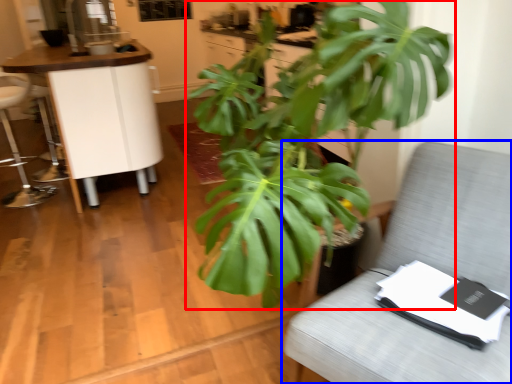
Question: Which point is further to the camera, houseplant (highlighted by a red box) or furniture (highlighted by a blue box)?

Choices:
 (A) houseplant
 (B) furniture

Answer: (B)